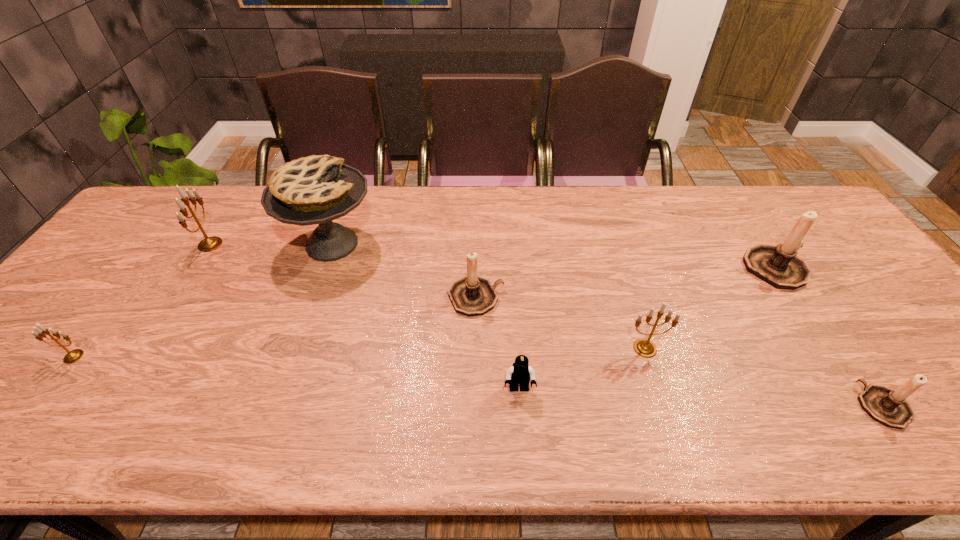
This screenshot has height=540, width=960. In order to click on the tallest object in this screenshot , I will do `click(312, 190)`.

Identify the location of the sixth object from right to left. (312, 190).

Find the location of a particular element. the biggest brown candle holder is located at coordinates (777, 265).

Find the location of a particular element. This screenshot has width=960, height=540. the farthest gold candelabrum is located at coordinates (208, 244).

Locate an element on the screen. The width and height of the screenshot is (960, 540). the seventh object from right to left is located at coordinates (208, 244).

At what (x,y) coordinates should I click in order to perform the action: click on the rightmost gold candelabrum. Please return your answer as a coordinate pair (x, y). The image size is (960, 540). Looking at the image, I should click on (643, 347).

Locate an element on the screen. the second smallest gold candelabrum is located at coordinates (643, 347).

Locate an element on the screen. Image resolution: width=960 pixels, height=540 pixels. the third candelabrum from left to right is located at coordinates (472, 295).

You are a GUI agent. You are given a task and a screenshot of the screen. Output one action in this format:
    pyautogui.click(x=<x>, y=<y>)
    Task: Click on the second smallest brown candle holder
    The width and height of the screenshot is (960, 540).
    Given the screenshot: What is the action you would take?
    pyautogui.click(x=472, y=295)

The height and width of the screenshot is (540, 960). Identify the location of the smallest brown candle holder. (888, 407).